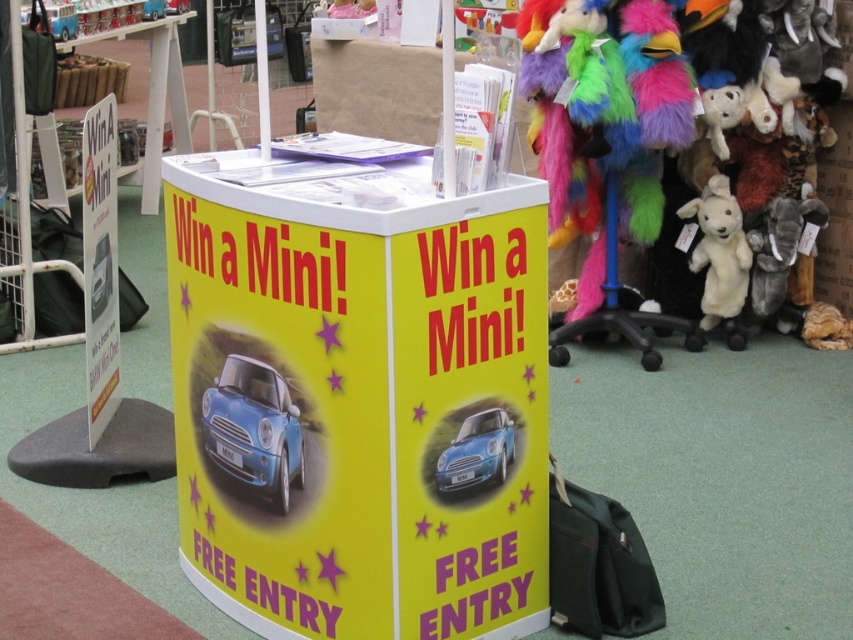
Is fluffy plush parrot at right bigger than white plush lamb at right?

Correct, fluffy plush parrot at right is larger in size than white plush lamb at right.

Who is positioned more to the left, fluffy plush parrot at right or white plush lamb at right?

fluffy plush parrot at right

Which is behind, point (596, 260) or point (738, 285)?

The point (596, 260) is more distant.

Locate an element on the screen. The height and width of the screenshot is (640, 853). fluffy plush parrot at right is located at coordinates (605, 132).

Does point (706, 182) lie in front of point (488, 449)?

No, (706, 182) is further to viewer.

Which is in front, point (733, 253) or point (454, 465)?

Point (454, 465)

Is point (726, 291) positioned in front of point (463, 483)?

That is False.

Locate an element on the screen. white plush lamb at right is located at coordinates (718, 252).

Who is positioned more to the left, blue glossy car at center or shiny blue car at center?

Positioned to the left is blue glossy car at center.

Between blue glossy car at center and shiny blue car at center, which one has more height?

With more height is blue glossy car at center.

This screenshot has width=853, height=640. What are the coordinates of `blue glossy car at center` in the screenshot? It's located at (254, 428).